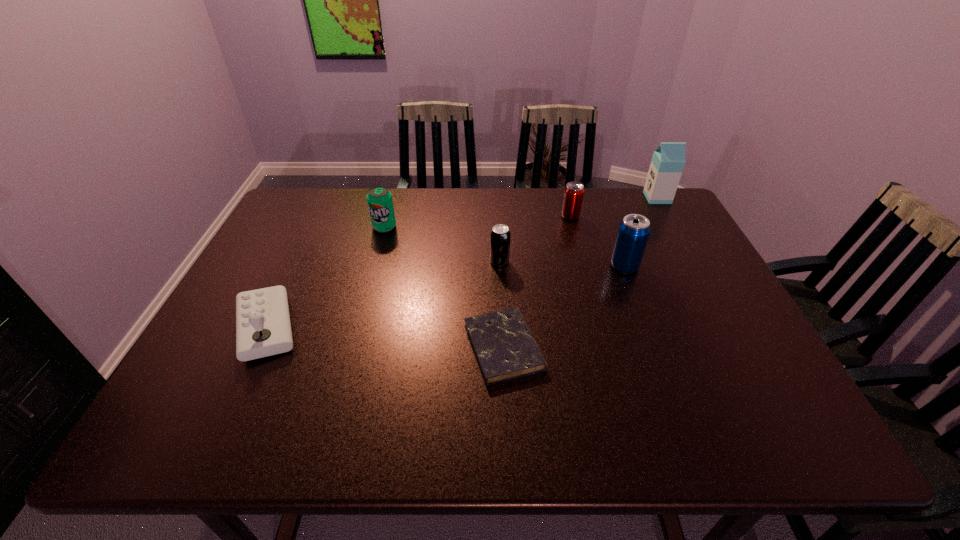
Locate an element on the screen. The width and height of the screenshot is (960, 540). free area in between the third soda can from left to right and the sixth object from right to left is located at coordinates (477, 222).

Identify the location of unoccupied position between the rightmost object and the leftmost object. The image size is (960, 540). click(x=462, y=263).

The width and height of the screenshot is (960, 540). Identify the location of vacant area that lies between the leftmost object and the rightmost object. (462, 263).

What are the coordinates of `free point between the third object from right to left and the leftmost soda can` in the screenshot? It's located at pyautogui.click(x=477, y=222).

In order to click on free point between the tallest object and the leftmost object in this screenshot , I will do `click(462, 263)`.

This screenshot has height=540, width=960. Identify the location of free space between the shortest object and the second object from left to right. (444, 287).

At what (x,y) coordinates should I click in order to perform the action: click on blank region between the leftmost soda can and the third object from right to left. Please return your answer as a coordinate pair (x, y). Looking at the image, I should click on (477, 222).

Where is `vacant space that is in between the shortest object and the rightmost object`? This screenshot has height=540, width=960. vacant space that is in between the shortest object and the rightmost object is located at coordinates (581, 273).

This screenshot has height=540, width=960. I want to click on object that is the fifth nearest to the joystick, so click(x=632, y=236).

Find the location of `the second closest object to the tallest object`. the second closest object to the tallest object is located at coordinates (632, 236).